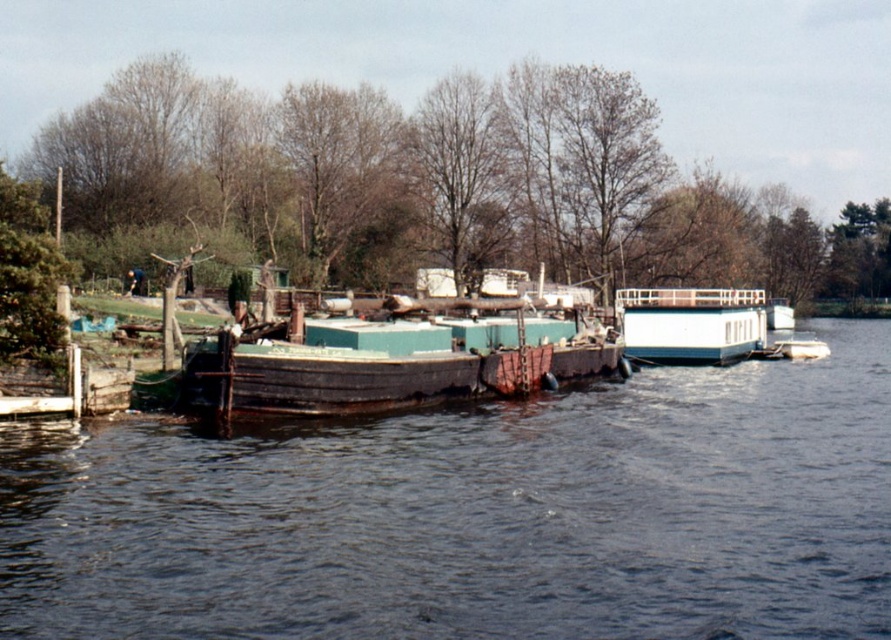
Between point (603, 566) and point (666, 362), which one is positioned in front?

Point (603, 566) is more forward.

Between dark brown water at center and white glossy houseboat at center, which one has less height?

Standing shorter between the two is dark brown water at center.

At what (x,y) coordinates should I click in order to perform the action: click on dark brown water at center. Please return your answer as a coordinate pair (x, y). Looking at the image, I should click on (476, 515).

The image size is (891, 640). Identify the location of dark brown water at center. (476, 515).